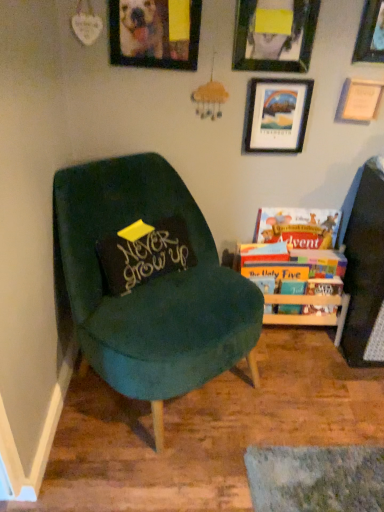
This screenshot has width=384, height=512. I want to click on vacant space in between velvet green chair at left and hardcover books at right, placed as the 2th book when sorted from top to bottom, so click(285, 372).